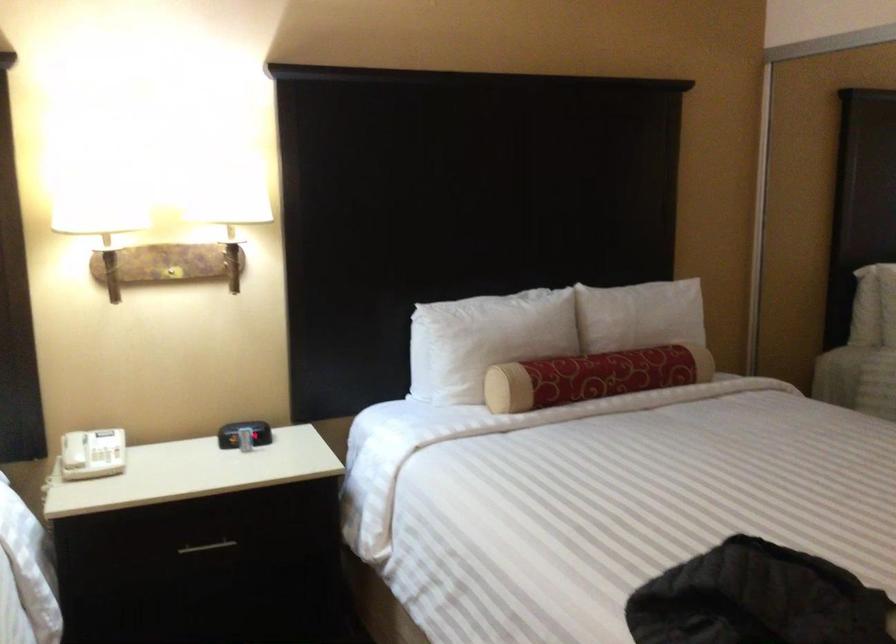
Find the location of a particular element. silver drawer handle is located at coordinates (207, 547).